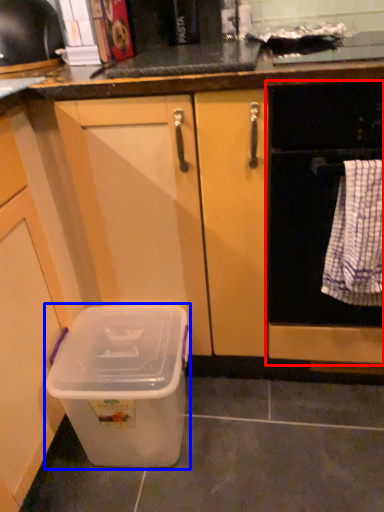
Question: Among these objects, which one is farthest to the camera, home appliance (highlighted by a red box) or storage box (highlighted by a blue box)?

Choices:
 (A) home appliance
 (B) storage box

Answer: (B)